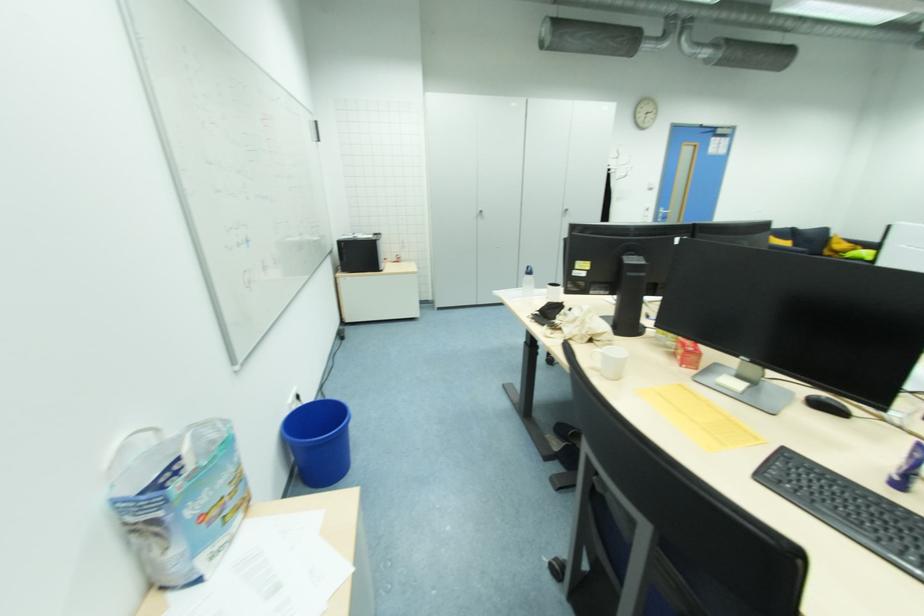
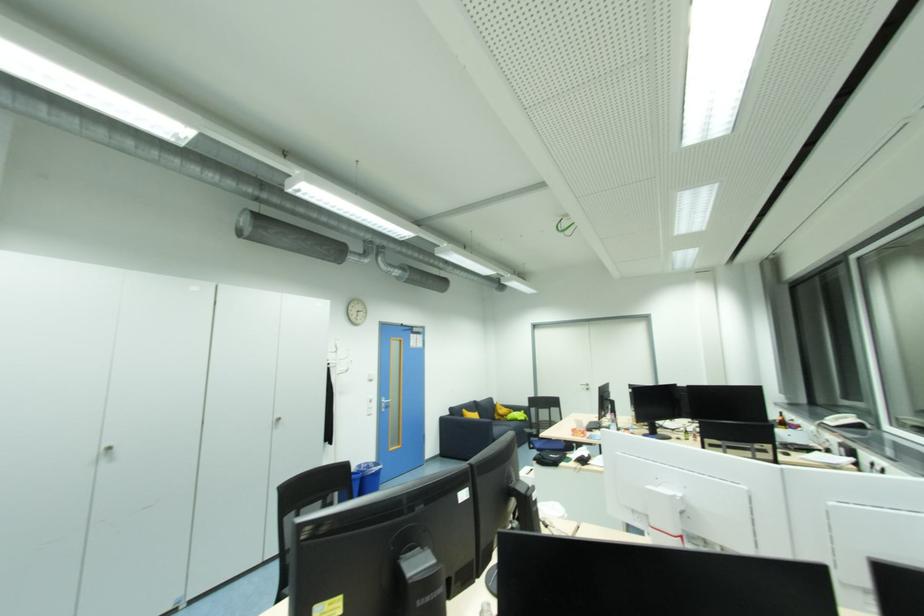
Locate, in the second image, the point that corresponds to the point at 663,213 in the first image.

(386, 402)